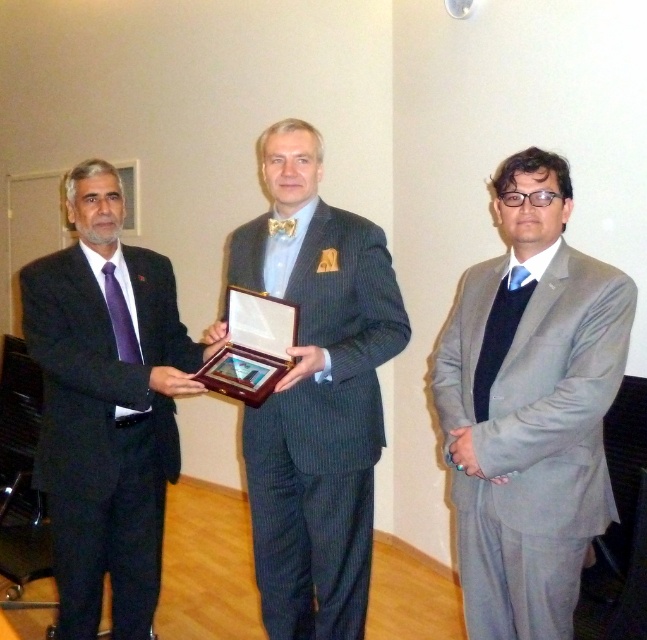
Describe the element at coordinates (529, 406) in the screenshot. I see `gray suit at center` at that location.

What are the coordinates of `gray suit at center` in the screenshot? It's located at (529, 406).

This screenshot has height=640, width=647. Find the location of `gray suit at center`. gray suit at center is located at coordinates click(529, 406).

Is gray suit at center in front of pinstriped suit at center?

That is True.

Between gray suit at center and pinstriped suit at center, which one appears on the left side from the viewer's perspective?

pinstriped suit at center is more to the left.

The image size is (647, 640). What do you see at coordinates (529, 406) in the screenshot? I see `gray suit at center` at bounding box center [529, 406].

Find the location of a particular element. gray suit at center is located at coordinates (529, 406).

Which of these two, pinstriped suit at center or matte black suit at left, stands shorter?

With less height is matte black suit at left.

This screenshot has height=640, width=647. What do you see at coordinates (314, 394) in the screenshot? I see `pinstriped suit at center` at bounding box center [314, 394].

Is point (265, 540) positioned before point (63, 580)?

No, it is not.

At what (x,y) coordinates should I click in order to perform the action: click on pinstriped suit at center. Please return your answer as a coordinate pair (x, y). The width and height of the screenshot is (647, 640). Looking at the image, I should click on (314, 394).